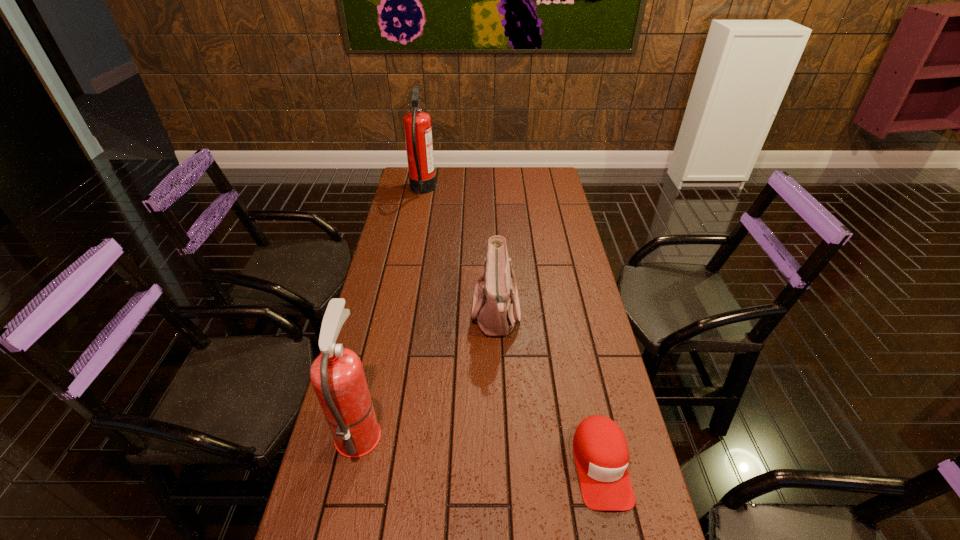
Where is `the farthest object`? Image resolution: width=960 pixels, height=540 pixels. the farthest object is located at coordinates (417, 125).

I want to click on the nearer fire extinguisher, so click(x=337, y=375).

At what (x,y) coordinates should I click in order to perform the action: click on shoulder bag. Please return your answer as a coordinate pair (x, y). Looking at the image, I should click on (496, 307).

Identify the location of the third object from left to right. (496, 307).

Find the location of a particular element. baseball cap is located at coordinates (601, 453).

Where is `the shortest object`? The width and height of the screenshot is (960, 540). the shortest object is located at coordinates (601, 453).

Where is `blank space located on the front-facing side of the farthest object`? blank space located on the front-facing side of the farthest object is located at coordinates [x=500, y=191].

This screenshot has height=540, width=960. I want to click on free space located with the handle and hose on the nearer fire extinguisher, so click(537, 430).

Identify the location of free space located on the front pocket of the second farthest object. The image size is (960, 540). click(x=372, y=314).

This screenshot has width=960, height=540. In order to click on free space located on the front pocket of the second farthest object in this screenshot , I will do `click(393, 314)`.